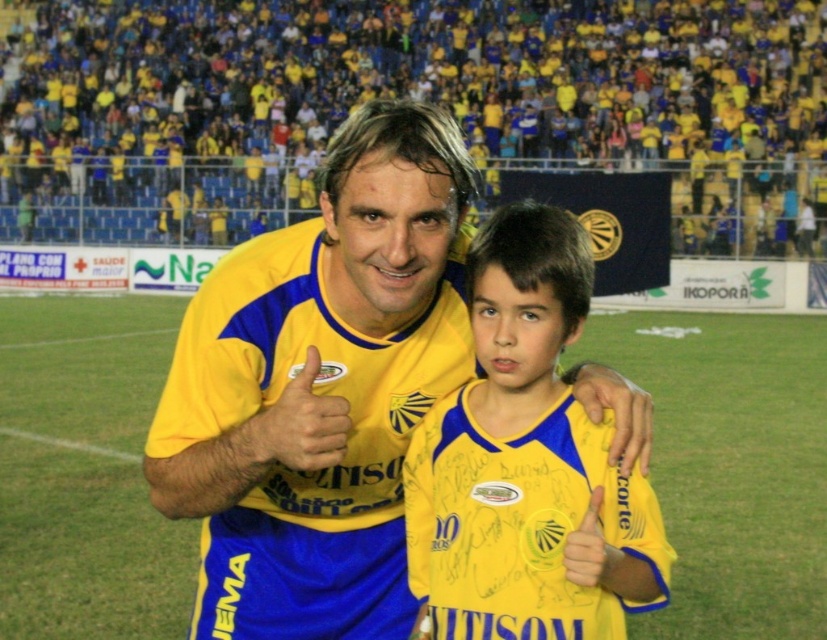
Question: Is yellow matte jersey at center closer to the viewer compared to yellow jersey at center?

Choices:
 (A) yes
 (B) no

Answer: (B)

Question: Is yellow matte jersey at center above yellow jersey at center?

Choices:
 (A) no
 (B) yes

Answer: (B)

Question: Is yellow matte jersey at center smaller than yellow jersey at center?

Choices:
 (A) yes
 (B) no

Answer: (B)

Question: Which object is farther from the camera taking this photo?

Choices:
 (A) yellow matte jersey at center
 (B) yellow jersey at center

Answer: (A)

Question: Which point is farther from the camera taking this photo?

Choices:
 (A) (600, 564)
 (B) (734, 90)

Answer: (B)